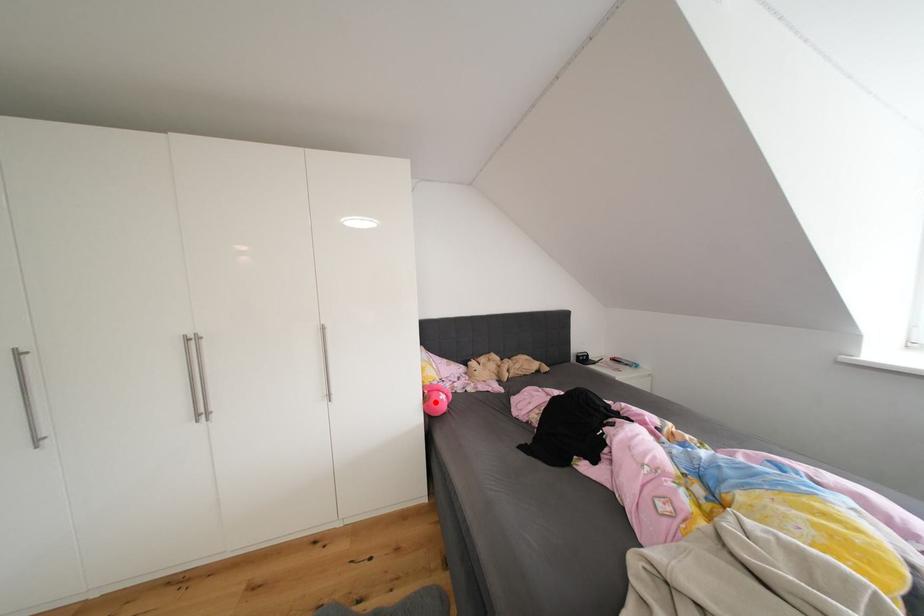
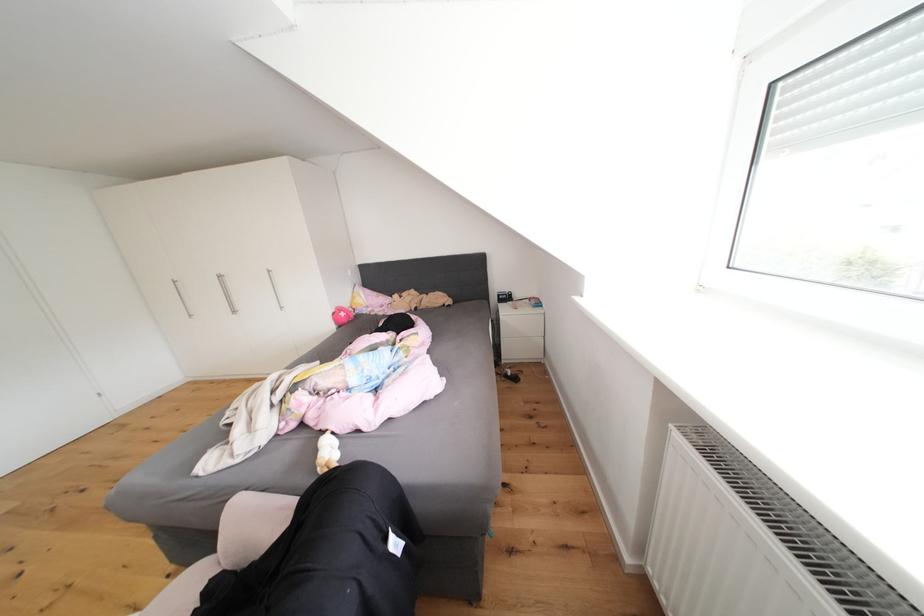
Question: I am providing you with two images of the same scene from different viewpoints. In image1, a red point is highlighted. Considering the same 3D point in image2, which of the following is correct?

Choices:
 (A) It is closer
 (B) It is farther

Answer: (A)